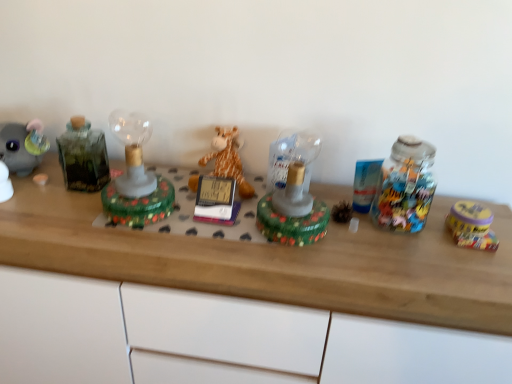
Where is `free region on the left part of yellow matte tin at right, the first toy when ordered from right to left`? This screenshot has width=512, height=384. free region on the left part of yellow matte tin at right, the first toy when ordered from right to left is located at coordinates (409, 236).